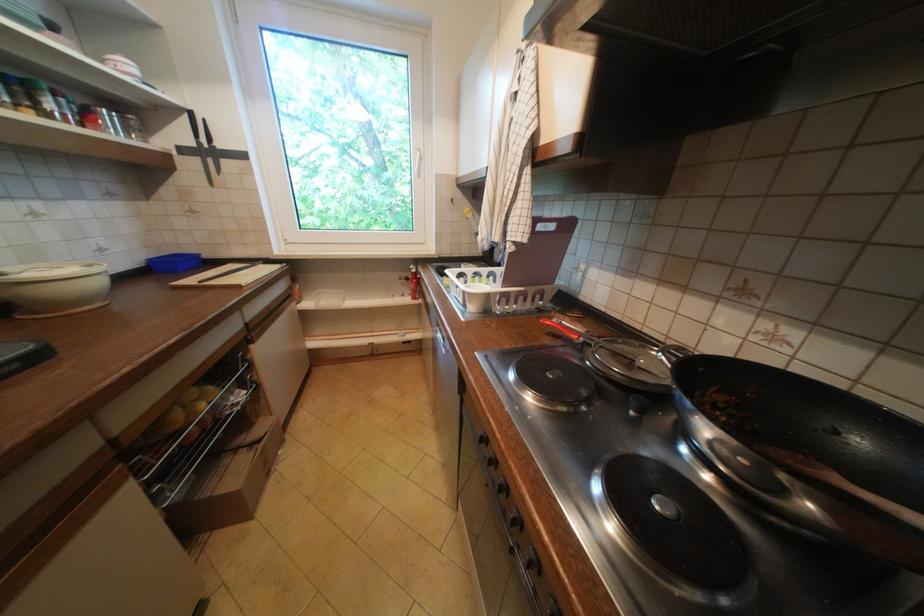
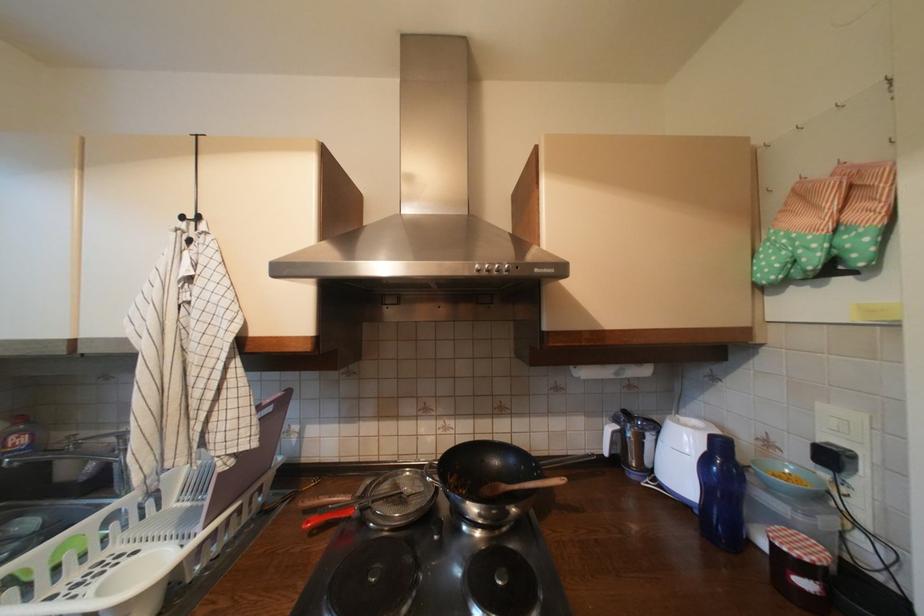
Find the pixel in the second image that matches (x=877, y=496) in the first image.

(525, 488)